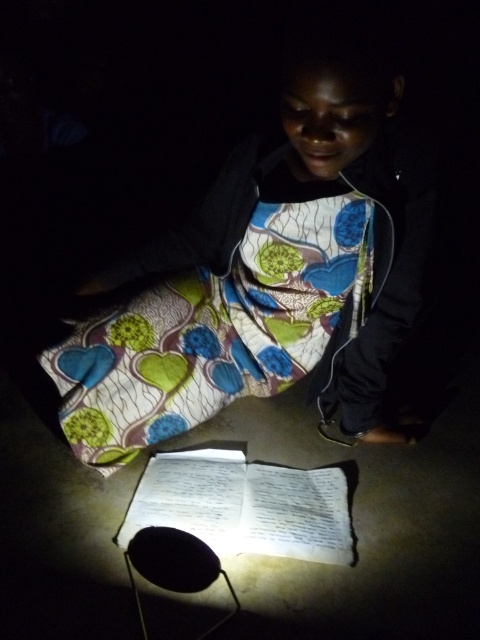
Is printed fabric dress at center taller than white paper book at center?

Yes, printed fabric dress at center is taller than white paper book at center.

In the scene shown: Is printed fabric dress at center to the left of white paper book at center from the viewer's perspective?

→ No, printed fabric dress at center is not to the left of white paper book at center.

Locate an element on the screen. This screenshot has height=640, width=480. printed fabric dress at center is located at coordinates (267, 273).